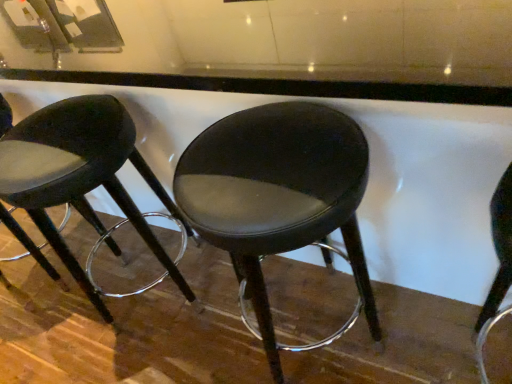
I want to click on free space above black leather stool at center, the 1th stool when ordered from right to left (from a real-world perspective), so click(254, 143).